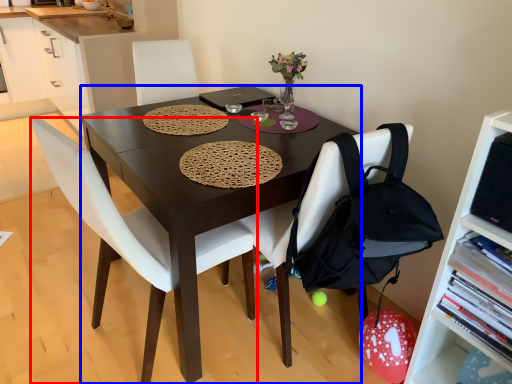
Question: Which object is further to the camera taking this photo, chair (highlighted by a red box) or desk (highlighted by a blue box)?

Choices:
 (A) chair
 (B) desk

Answer: (B)